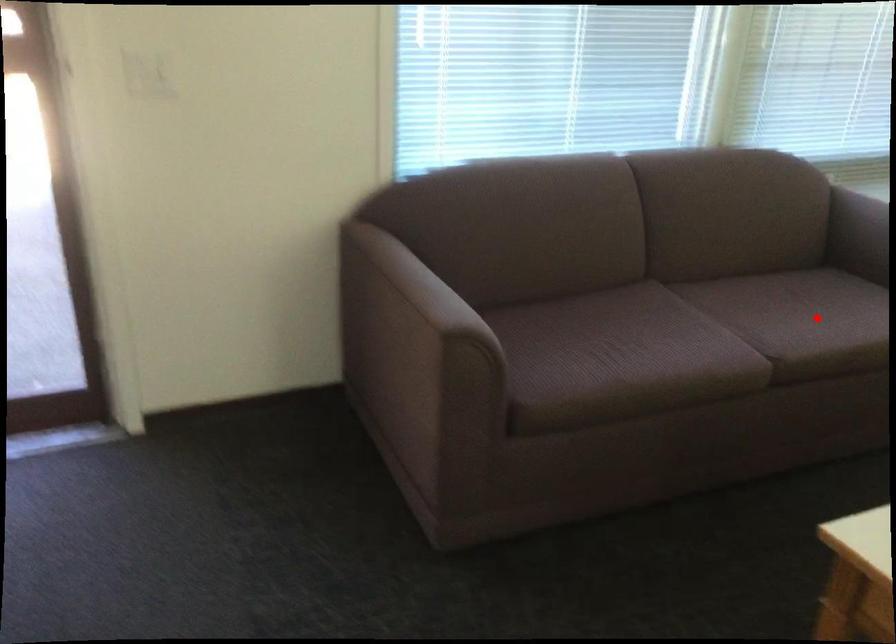
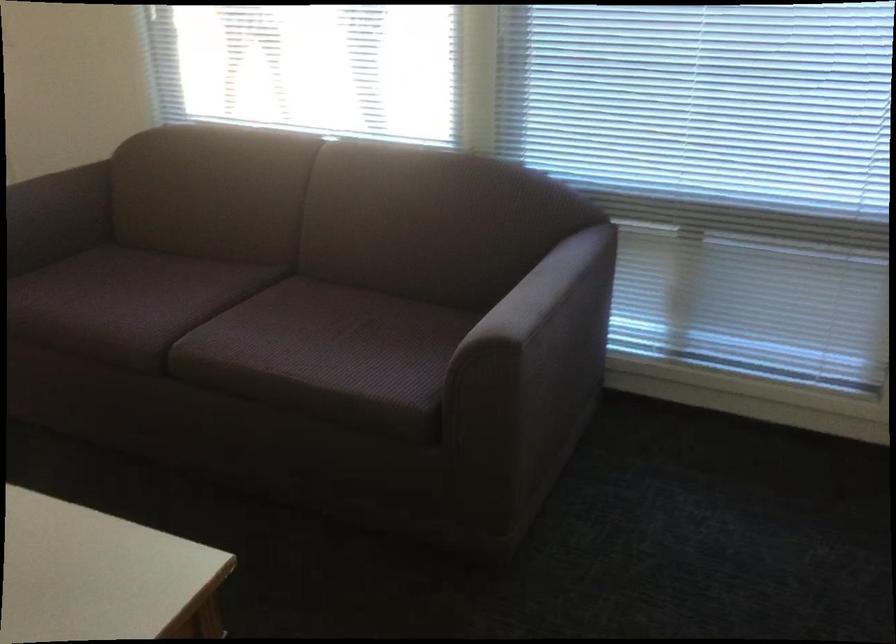
Question: I am providing you with two images of the same scene from different viewpoints. A red point is shown in image1. For the corresponding object point in image2, is it positioned nearer or farther from the camera?

Choices:
 (A) Nearer
 (B) Farther

Answer: (A)